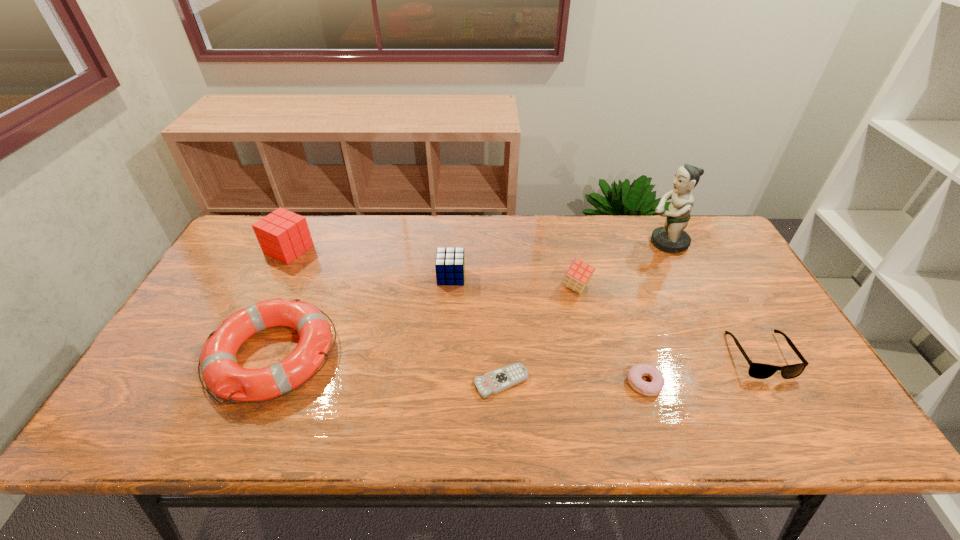
Find the location of a particular element. the shortest object is located at coordinates (493, 382).

The image size is (960, 540). Identify the location of blank area located 0.230m on the front-facing side of the figurine. click(x=575, y=243).

Identify the location of vacant space situated 0.300m on the front-facing side of the figurine. The height and width of the screenshot is (540, 960). (553, 243).

I want to click on vacant region located 0.210m on the front-facing side of the figurine, so click(x=581, y=243).

You are a GUI agent. You are given a task and a screenshot of the screen. Output one action in this format:
    pyautogui.click(x=<x>, y=<y>)
    Task: Click on the free point located 0.270m on the right of the farthest cube
    This screenshot has height=540, width=960.
    Given the screenshot: What is the action you would take?
    pyautogui.click(x=396, y=249)

You are a GUI agent. You are given a task and a screenshot of the screen. Output one action in this format:
    pyautogui.click(x=<x>, y=<y>)
    Task: Click on the free space located on the back of the rightmost cube
    
    Given the screenshot: What is the action you would take?
    pyautogui.click(x=561, y=221)

The height and width of the screenshot is (540, 960). I want to click on vacant space located on the left of the third object from left to right, so click(345, 276).

Identify the location of vacant position located on the right of the life buoy. (484, 355).

I want to click on free region located on the front-facing side of the sunglasses, so click(x=799, y=423).

I want to click on vacant space located 0.130m on the right of the seventh tallest object, so click(716, 383).